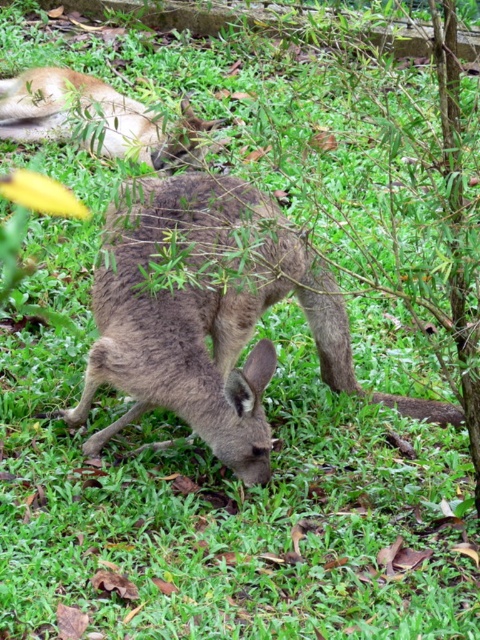
You are a wildlife photographer trying to capture a photo of both the brown fur kangaroo at center and the brown fur kangaroo at upper left. Which kangaroo is located more to the right in the image?

The brown fur kangaroo at center is positioned on the right side of brown fur kangaroo at upper left, so the brown fur kangaroo at center is more to the right.

You are a wildlife photographer trying to capture both the brown fur kangaroo at center and the brown fur kangaroo at upper left in your shot. Given that your camera can only focus on one kangaroo at a time, which kangaroo should you focus on first to ensure it fills more of the frame?

The brown fur kangaroo at center is wider than the brown fur kangaroo at upper left, so focusing on the brown fur kangaroo at center first will ensure it fills more of the frame.